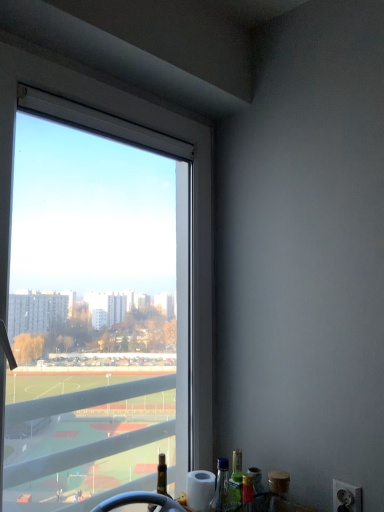
This screenshot has height=512, width=384. What do you see at coordinates (146, 134) in the screenshot? I see `transparent glass window at upper left` at bounding box center [146, 134].

Find the location of a particular element. This screenshot has height=512, width=384. white plastic power outlet at lower right is located at coordinates (346, 497).

Find the location of a particular element. This screenshot has height=512, width=384. transparent glass window at upper left is located at coordinates (146, 134).

Can you confirm if white plastic power outlet at lower right is thinner than transparent glass window at upper left?

Correct, the width of white plastic power outlet at lower right is less than that of transparent glass window at upper left.

Considering the positions of objects white plastic power outlet at lower right and transparent glass window at upper left in the image provided, who is more to the right, white plastic power outlet at lower right or transparent glass window at upper left?

From the viewer's perspective, white plastic power outlet at lower right appears more on the right side.

Are white plastic power outlet at lower right and transparent glass window at upper left far apart?

white plastic power outlet at lower right is near transparent glass window at upper left, not far away.

From the image's perspective, is white plastic power outlet at lower right under transparent glass window at upper left?

Indeed, from the image's perspective, white plastic power outlet at lower right is shown beneath transparent glass window at upper left.

Is green glass bottle at lower right closer to the viewer compared to transparent glass window at upper left?

No.

Does point (238, 475) come behind point (204, 350)?

That is False.

Is green glass bottle at lower right turned away from transparent glass window at upper left?

Yes, green glass bottle at lower right's orientation is away from transparent glass window at upper left.

From a real-world perspective, between green glass bottle at lower right and white plastic power outlet at lower right, who is vertically higher?

white plastic power outlet at lower right is physically above.

Who is taller, green glass bottle at lower right or white plastic power outlet at lower right?

green glass bottle at lower right.

How different are the orientations of green glass bottle at lower right and white plastic power outlet at lower right in degrees?

The angle between the facing direction of green glass bottle at lower right and the facing direction of white plastic power outlet at lower right is 87.5 degrees.

Considering the sizes of objects green glass bottle at lower right and white plastic power outlet at lower right in the image provided, who is wider, green glass bottle at lower right or white plastic power outlet at lower right?

green glass bottle at lower right.

Looking at the image, does transparent glass window at upper left seem bigger or smaller compared to white plastic power outlet at lower right?

transparent glass window at upper left is bigger than white plastic power outlet at lower right.

Where is `power outlet lying below the transparent glass window at upper left (from the image's perspective)`? power outlet lying below the transparent glass window at upper left (from the image's perspective) is located at coordinates (346, 497).

In the scene shown: From the image's perspective, between transparent glass window at upper left and white plastic power outlet at lower right, which one is located above?

transparent glass window at upper left.

Measure the distance from transparent glass window at upper left to white plastic power outlet at lower right.

transparent glass window at upper left and white plastic power outlet at lower right are 36.08 inches apart from each other.

Does transparent glass window at upper left turn towards green glass bottle at lower right?

Yes, transparent glass window at upper left is turned towards green glass bottle at lower right.

From the image's perspective, relative to green glass bottle at lower right, is transparent glass window at upper left above or below?

Based on their image positions, transparent glass window at upper left is located above green glass bottle at lower right.

Does transparent glass window at upper left have a larger size compared to green glass bottle at lower right?

Indeed, transparent glass window at upper left has a larger size compared to green glass bottle at lower right.

What's the angular difference between transparent glass window at upper left and green glass bottle at lower right's facing directions?

There is a 1.55-degree angle between the facing directions of transparent glass window at upper left and green glass bottle at lower right.

What's the angular difference between white plastic power outlet at lower right and green glass bottle at lower right's facing directions?

The angular difference between white plastic power outlet at lower right and green glass bottle at lower right is 87.5 degrees.

From a real-world perspective, which is physically below, white plastic power outlet at lower right or green glass bottle at lower right?

green glass bottle at lower right is physically lower.

Locate an element on the screen. bottle behind the white plastic power outlet at lower right is located at coordinates (235, 480).

Is white plastic power outlet at lower right looking in the opposite direction of green glass bottle at lower right?

That's not correct — white plastic power outlet at lower right is not looking away from green glass bottle at lower right.

Locate an element on the screen. power outlet on the right of the transparent glass window at upper left is located at coordinates (346, 497).

Identify the location of window on the left of the green glass bottle at lower right. This screenshot has width=384, height=512. (146, 134).

Estimate the real-world distances between objects in this image. Which object is closer to white plastic power outlet at lower right, green glass bottle at lower right or transparent glass window at upper left?

green glass bottle at lower right.

Looking at this image, based on their spatial positions, is green glass bottle at lower right or white plastic power outlet at lower right further from transparent glass window at upper left?

Based on the image, white plastic power outlet at lower right appears to be further to transparent glass window at upper left.

Based on their spatial positions, is transparent glass window at upper left or white plastic power outlet at lower right further from green glass bottle at lower right?

The object further to green glass bottle at lower right is transparent glass window at upper left.

Based on their spatial positions, is white plastic power outlet at lower right or green glass bottle at lower right closer to transparent glass window at upper left?

The object closer to transparent glass window at upper left is green glass bottle at lower right.

In the scene shown: Considering their positions, is transparent glass window at upper left positioned further to white plastic power outlet at lower right than green glass bottle at lower right?

Based on the image, transparent glass window at upper left appears to be further to white plastic power outlet at lower right.

Estimate the real-world distances between objects in this image. Which object is further from green glass bottle at lower right, white plastic power outlet at lower right or transparent glass window at upper left?

transparent glass window at upper left lies further to green glass bottle at lower right than the other object.

Find the location of a particular element. This screenshot has width=384, height=512. power outlet between transparent glass window at upper left and green glass bottle at lower right in the up-down direction is located at coordinates (346, 497).